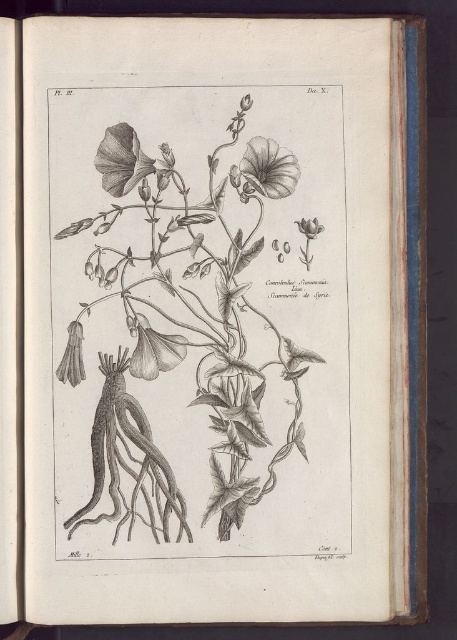
Question: Which object is closer to the camera taking this photo?

Choices:
 (A) smooth paper-like petal at upper center
 (B) smooth gray petal at upper center
 (C) gray pencil sketch plant at center
 (D) grayish-white textured flower at lower left

Answer: (C)

Question: Observing the image, what is the correct spatial positioning of gray pencil sketch plant at center in reference to smooth paper-like petal at upper center?

Choices:
 (A) above
 (B) below

Answer: (B)

Question: Considering the real-world distances, which object is closest to the smooth gray petal at upper center?

Choices:
 (A) grayish-white textured flower at lower left
 (B) gray pencil sketch plant at center
 (C) smooth paper-like petal at upper center

Answer: (C)

Question: Can you confirm if smooth paper-like petal at upper center is positioned to the left of grayish-white textured flower at lower left?

Choices:
 (A) yes
 (B) no

Answer: (B)

Question: Can you confirm if smooth gray petal at upper center is thinner than smooth paper-like petal at upper center?

Choices:
 (A) no
 (B) yes

Answer: (A)

Question: Considering the real-world distances, which object is farthest from the grayish-white textured flower at lower left?

Choices:
 (A) smooth paper-like petal at upper center
 (B) gray pencil sketch plant at center
 (C) smooth gray petal at upper center

Answer: (A)